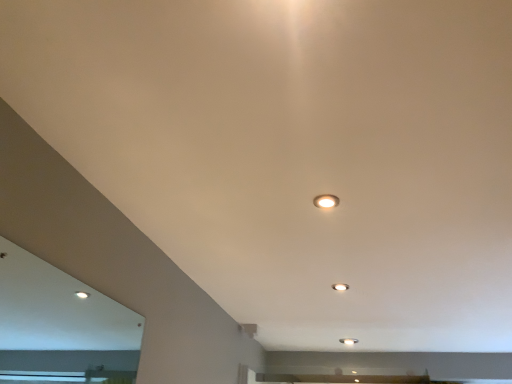
Where is `matte white light fixture at center`? Image resolution: width=512 pixels, height=384 pixels. matte white light fixture at center is located at coordinates (326, 201).

Describe the element at coordinates (326, 201) in the screenshot. I see `matte white light fixture at center` at that location.

Locate an element on the screen. The height and width of the screenshot is (384, 512). matte white light fixture at center is located at coordinates (326, 201).